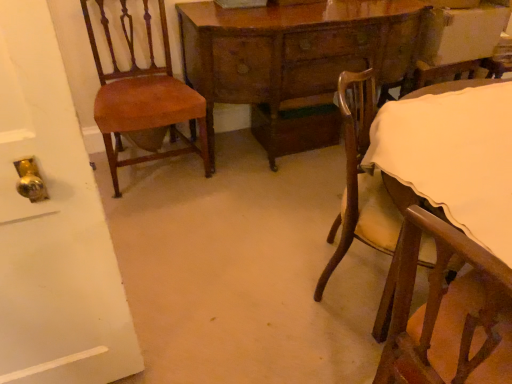
Find the location of a particular element. The image size is (512, 384). mahogany wood chair at left, which ranks as the first chair in left-to-right order is located at coordinates (143, 97).

Locate an element on the screen. The width and height of the screenshot is (512, 384). wooden table at center is located at coordinates (294, 61).

Does point (403, 211) lie behind point (121, 164)?

That is False.

Is wooden chair with cream cushion at lower right, which is counted as the second chair, starting from the left, bigger than mahogany wood chair at left, which ranks as the 2th chair in right-to-left order?

Indeed, wooden chair with cream cushion at lower right, which is counted as the second chair, starting from the left, has a larger size compared to mahogany wood chair at left, which ranks as the 2th chair in right-to-left order.

Considering the relative sizes of wooden chair with cream cushion at lower right, which ranks as the 1th chair in right-to-left order, and mahogany wood chair at left, which ranks as the first chair in left-to-right order, in the image provided, is wooden chair with cream cushion at lower right, which ranks as the 1th chair in right-to-left order, taller than mahogany wood chair at left, which ranks as the first chair in left-to-right order,?

No, wooden chair with cream cushion at lower right, which ranks as the 1th chair in right-to-left order, is not taller than mahogany wood chair at left, which ranks as the first chair in left-to-right order.

How far apart are wooden chair with cream cushion at lower right, which ranks as the 1th chair in right-to-left order, and mahogany wood chair at left, which ranks as the first chair in left-to-right order?

The distance of wooden chair with cream cushion at lower right, which ranks as the 1th chair in right-to-left order, from mahogany wood chair at left, which ranks as the first chair in left-to-right order, is 1.14 meters.

Does wooden chair with cream cushion at lower right, which is counted as the second chair, starting from the left, touch wooden table at center?

They are not placed beside each other.

In the image, is wooden chair with cream cushion at lower right, which is counted as the second chair, starting from the left, on the left side or the right side of wooden table at center?

In the image, wooden chair with cream cushion at lower right, which is counted as the second chair, starting from the left, appears on the right side of wooden table at center.

Could you tell me if wooden chair with cream cushion at lower right, which ranks as the 1th chair in right-to-left order, is facing wooden table at center?

No, wooden chair with cream cushion at lower right, which ranks as the 1th chair in right-to-left order, is not oriented towards wooden table at center.

Considering the sizes of objects wooden chair with cream cushion at lower right, which is counted as the second chair, starting from the left, and wooden table at center in the image provided, who is wider, wooden chair with cream cushion at lower right, which is counted as the second chair, starting from the left, or wooden table at center?

wooden chair with cream cushion at lower right, which is counted as the second chair, starting from the left.

Could you tell me if wooden table at center is turned towards wooden chair with cream cushion at lower right, which ranks as the 1th chair in right-to-left order?

Yes, wooden table at center is facing wooden chair with cream cushion at lower right, which ranks as the 1th chair in right-to-left order.

Choose the correct answer: Is wooden table at center inside wooden chair with cream cushion at lower right, which ranks as the 1th chair in right-to-left order, or outside it?

wooden table at center lies outside wooden chair with cream cushion at lower right, which ranks as the 1th chair in right-to-left order.

What's the angular difference between wooden table at center and wooden chair with cream cushion at lower right, which ranks as the 1th chair in right-to-left order,'s facing directions?

91.3 degrees separate the facing orientations of wooden table at center and wooden chair with cream cushion at lower right, which ranks as the 1th chair in right-to-left order.

Between wooden table at center and wooden chair with cream cushion at lower right, which ranks as the 1th chair in right-to-left order, which one is positioned in front?

wooden chair with cream cushion at lower right, which ranks as the 1th chair in right-to-left order.

Choose the correct answer: Is mahogany wood chair at left, which ranks as the first chair in left-to-right order, inside wooden table at center or outside it?

mahogany wood chair at left, which ranks as the first chair in left-to-right order, lies outside wooden table at center.

Could you measure the distance between mahogany wood chair at left, which ranks as the 2th chair in right-to-left order, and wooden table at center?

50.92 centimeters.

From the image's perspective, would you say mahogany wood chair at left, which ranks as the 2th chair in right-to-left order, is shown under wooden table at center?

Indeed, from the image's perspective, mahogany wood chair at left, which ranks as the 2th chair in right-to-left order, is shown beneath wooden table at center.

Considering the positions of point (358, 21) and point (186, 147), is point (358, 21) closer or farther from the camera than point (186, 147)?

Point (358, 21) is positioned closer to the camera compared to point (186, 147).

Who is more distant, wooden table at center or mahogany wood chair at left, which ranks as the first chair in left-to-right order?

wooden table at center is behind.

Is wooden table at center located outside mahogany wood chair at left, which ranks as the 2th chair in right-to-left order?

Absolutely, wooden table at center is external to mahogany wood chair at left, which ranks as the 2th chair in right-to-left order.

Image resolution: width=512 pixels, height=384 pixels. I want to click on chair above the wooden table at center (from a real-world perspective), so click(143, 97).

From the image's perspective, would you say mahogany wood chair at left, which ranks as the 2th chair in right-to-left order, is shown under wooden chair with cream cushion at lower right, which is counted as the second chair, starting from the left?

No, from the image's perspective, mahogany wood chair at left, which ranks as the 2th chair in right-to-left order, is not below wooden chair with cream cushion at lower right, which is counted as the second chair, starting from the left.

Can you confirm if mahogany wood chair at left, which ranks as the first chair in left-to-right order, is positioned to the right of wooden chair with cream cushion at lower right, which ranks as the 1th chair in right-to-left order?

No.

Would you say mahogany wood chair at left, which ranks as the 2th chair in right-to-left order, is inside or outside wooden chair with cream cushion at lower right, which is counted as the second chair, starting from the left?

mahogany wood chair at left, which ranks as the 2th chair in right-to-left order, lies outside wooden chair with cream cushion at lower right, which is counted as the second chair, starting from the left.

What are the coordinates of `chair behind the wooden chair with cream cushion at lower right, which ranks as the 1th chair in right-to-left order` in the screenshot? It's located at point(143,97).

Image resolution: width=512 pixels, height=384 pixels. In order to click on table located above the wooden chair with cream cushion at lower right, which is counted as the second chair, starting from the left (from a real-world perspective) in this screenshot , I will do `click(294, 61)`.

Looking at the image, which one is located further to mahogany wood chair at left, which ranks as the first chair in left-to-right order, wooden chair with cream cushion at lower right, which ranks as the 1th chair in right-to-left order, or wooden table at center?

wooden chair with cream cushion at lower right, which ranks as the 1th chair in right-to-left order, is further to mahogany wood chair at left, which ranks as the first chair in left-to-right order.

Which object lies further to the anchor point wooden chair with cream cushion at lower right, which ranks as the 1th chair in right-to-left order, mahogany wood chair at left, which ranks as the 2th chair in right-to-left order, or wooden table at center?

mahogany wood chair at left, which ranks as the 2th chair in right-to-left order, is positioned further to the anchor wooden chair with cream cushion at lower right, which ranks as the 1th chair in right-to-left order.

Based on their spatial positions, is wooden table at center or mahogany wood chair at left, which ranks as the first chair in left-to-right order, further from wooden chair with cream cushion at lower right, which is counted as the second chair, starting from the left?

mahogany wood chair at left, which ranks as the first chair in left-to-right order, is positioned further to the anchor wooden chair with cream cushion at lower right, which is counted as the second chair, starting from the left.

Based on their spatial positions, is wooden table at center or wooden chair with cream cushion at lower right, which is counted as the second chair, starting from the left, further from mahogany wood chair at left, which ranks as the first chair in left-to-right order?

wooden chair with cream cushion at lower right, which is counted as the second chair, starting from the left, lies further to mahogany wood chair at left, which ranks as the first chair in left-to-right order, than the other object.

Based on their spatial positions, is wooden chair with cream cushion at lower right, which is counted as the second chair, starting from the left, or mahogany wood chair at left, which ranks as the first chair in left-to-right order, closer to wooden table at center?

Among the two, mahogany wood chair at left, which ranks as the first chair in left-to-right order, is located nearer to wooden table at center.

Which object lies further to the anchor point wooden table at center, mahogany wood chair at left, which ranks as the 2th chair in right-to-left order, or wooden chair with cream cushion at lower right, which ranks as the 1th chair in right-to-left order?

wooden chair with cream cushion at lower right, which ranks as the 1th chair in right-to-left order, lies further to wooden table at center than the other object.

The image size is (512, 384). In order to click on table between mahogany wood chair at left, which ranks as the first chair in left-to-right order, and wooden chair with cream cushion at lower right, which is counted as the second chair, starting from the left in this screenshot , I will do `click(294, 61)`.